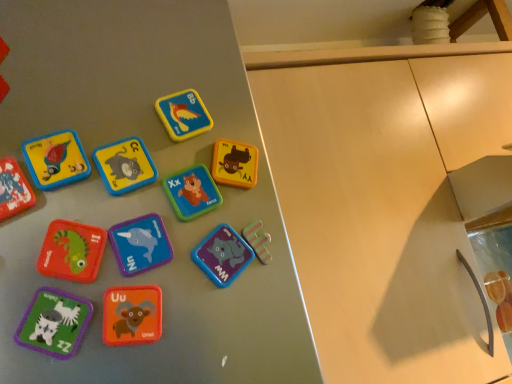
The image size is (512, 384). Find the location of `matte plastic letter at center, which ranks as the 7th toy in bottom-to-top order`. matte plastic letter at center, which ranks as the 7th toy in bottom-to-top order is located at coordinates (192, 192).

Where is `matte yellow square at upper center, the tenth toy ordered from the bottom`? The image size is (512, 384). matte yellow square at upper center, the tenth toy ordered from the bottom is located at coordinates (183, 115).

Image resolution: width=512 pixels, height=384 pixels. Find the location of `purple matte magnet at center, marked as the third toy in a bottom-to-top arrangement`. purple matte magnet at center, marked as the third toy in a bottom-to-top arrangement is located at coordinates (222, 255).

What is the approximate width of rubberized matte green lizard at lower left, the 7th toy viewed from the top?

1.66 inches.

Image resolution: width=512 pixels, height=384 pixels. Describe the element at coordinates (72, 251) in the screenshot. I see `rubberized matte green lizard at lower left, the 7th toy viewed from the top` at that location.

Locate an element on the screen. matte plastic letter at center, which ranks as the 4th toy in top-to-bottom order is located at coordinates (192, 192).

Which is closer, (x=179, y=111) or (x=127, y=247)?

The point (x=127, y=247) is closer.

Which object is thinner, matte yellow square at upper center, the tenth toy ordered from the bottom, or purple matte dolphin at center, positioned as the sixth toy in top-to-bottom order?

Thinner between the two is purple matte dolphin at center, positioned as the sixth toy in top-to-bottom order.

How different are the orientations of matte yellow square at upper center, which is counted as the 1th toy, starting from the top, and purple matte dolphin at center, positioned as the sixth toy in top-to-bottom order, in degrees?

0.00103 degrees.

Are matte yellow square at upper center, the tenth toy ordered from the bottom, and purple matte dolphin at center, the fifth toy ordered from the bottom, located far from each other?

They are positioned close to each other.

Is purple matte magnet at center, which appears as the 8th toy when viewed from the top, at the back of matte yellow square at upper center, the tenth toy ordered from the bottom?

No, purple matte magnet at center, which appears as the 8th toy when viewed from the top, is not at the back of matte yellow square at upper center, the tenth toy ordered from the bottom.

Would you say matte yellow square at upper center, which is counted as the 1th toy, starting from the top, is a long distance from purple matte magnet at center, which appears as the 8th toy when viewed from the top?

No, matte yellow square at upper center, which is counted as the 1th toy, starting from the top, is not far away from purple matte magnet at center, which appears as the 8th toy when viewed from the top.

Starting from the matte yellow square at upper center, the tenth toy ordered from the bottom, which toy is the 2nd one to the right? Please provide its 2D coordinates.

[(222, 255)]

How different are the orientations of rubberized matte green lizard at lower left, which appears as the 4th toy when ordered from the bottom, and matte plastic letter at center, positioned as the eighth toy in bottom-to-top order, in degrees?

rubberized matte green lizard at lower left, which appears as the 4th toy when ordered from the bottom, and matte plastic letter at center, positioned as the eighth toy in bottom-to-top order, are facing 0.00124 degrees away from each other.

Does rubberized matte green lizard at lower left, the 7th toy viewed from the top, have a greater width compared to matte plastic letter at center, positioned as the eighth toy in bottom-to-top order?

Correct, the width of rubberized matte green lizard at lower left, the 7th toy viewed from the top, exceeds that of matte plastic letter at center, positioned as the eighth toy in bottom-to-top order.

This screenshot has width=512, height=384. Identify the location of the 1st toy to the right of the rubberized matte green lizard at lower left, which appears as the 4th toy when ordered from the bottom, starting your count from the anchor. (125, 165).

Does rubberized matte green lizard at lower left, the 7th toy viewed from the top, touch matte plastic letter at center, positioned as the eighth toy in bottom-to-top order?

Absolutely, rubberized matte green lizard at lower left, the 7th toy viewed from the top, is next to and touching matte plastic letter at center, positioned as the eighth toy in bottom-to-top order.

Between point (80, 267) and point (217, 255), which one is positioned behind?

Point (217, 255)

Does rubberized matte green lizard at lower left, the 7th toy viewed from the top, have a greater width compared to purple matte magnet at center, marked as the third toy in a bottom-to-top arrangement?

No.

Considering their positions, is rubberized matte green lizard at lower left, which appears as the 4th toy when ordered from the bottom, located in front of or behind purple matte magnet at center, which appears as the 8th toy when viewed from the top?

rubberized matte green lizard at lower left, which appears as the 4th toy when ordered from the bottom, is positioned closer to the viewer than purple matte magnet at center, which appears as the 8th toy when viewed from the top.

Is purple matte magnet at center, marked as the third toy in a bottom-to-top arrangement, located within rubberized matte green lizard at lower left, which appears as the 4th toy when ordered from the bottom?

No, rubberized matte green lizard at lower left, which appears as the 4th toy when ordered from the bottom, does not contain purple matte magnet at center, marked as the third toy in a bottom-to-top arrangement.

Which is more to the left, matte plastic letter at center, positioned as the eighth toy in bottom-to-top order, or rubberized matte green lizard at lower left, the 7th toy viewed from the top?

Positioned to the left is rubberized matte green lizard at lower left, the 7th toy viewed from the top.

Would you say matte plastic letter at center, positioned as the eighth toy in bottom-to-top order, is a long distance from rubberized matte green lizard at lower left, which appears as the 4th toy when ordered from the bottom?

No, matte plastic letter at center, positioned as the eighth toy in bottom-to-top order, is not far away from rubberized matte green lizard at lower left, which appears as the 4th toy when ordered from the bottom.

From the image's perspective, is matte plastic letter at center, positioned as the eighth toy in bottom-to-top order, located above rubberized matte green lizard at lower left, the 7th toy viewed from the top?

Indeed, from the image's perspective, matte plastic letter at center, positioned as the eighth toy in bottom-to-top order, is shown above rubberized matte green lizard at lower left, the 7th toy viewed from the top.

From the image's perspective, which toy is the 4th one below the matte plastic letter at center, positioned as the eighth toy in bottom-to-top order? Please provide its 2D coordinates.

[(72, 251)]

This screenshot has width=512, height=384. I want to click on the 8th toy positioned below the matte yellow square at upper center, which is counted as the 1th toy, starting from the top (from a real-world perspective), so click(54, 323).

Which is behind, matte green fabric zebra at lower left, arranged as the ninth toy when viewed from the top, or matte yellow square at upper center, the tenth toy ordered from the bottom?

matte yellow square at upper center, the tenth toy ordered from the bottom, is more distant.

Would you say matte yellow square at upper center, the tenth toy ordered from the bottom, is part of matte green fabric zebra at lower left, arranged as the ninth toy when viewed from the top,'s contents?

That's incorrect, matte yellow square at upper center, the tenth toy ordered from the bottom, is not inside matte green fabric zebra at lower left, arranged as the ninth toy when viewed from the top.

Can you confirm if matte green fabric zebra at lower left, which is the 2th toy in bottom-to-top order, is thinner than matte yellow square at upper center, the tenth toy ordered from the bottom?

In fact, matte green fabric zebra at lower left, which is the 2th toy in bottom-to-top order, might be wider than matte yellow square at upper center, the tenth toy ordered from the bottom.

Does point (158, 217) come closer to viewer compared to point (35, 313)?

No, (158, 217) is further to viewer.

Considering the relative sizes of purple matte dolphin at center, positioned as the sixth toy in top-to-bottom order, and matte green fabric zebra at lower left, which is the 2th toy in bottom-to-top order, in the image provided, is purple matte dolphin at center, positioned as the sixth toy in top-to-bottom order, smaller than matte green fabric zebra at lower left, which is the 2th toy in bottom-to-top order,?

Indeed, purple matte dolphin at center, positioned as the sixth toy in top-to-bottom order, has a smaller size compared to matte green fabric zebra at lower left, which is the 2th toy in bottom-to-top order.

Could you tell me if purple matte dolphin at center, positioned as the sixth toy in top-to-bottom order, is facing matte green fabric zebra at lower left, arranged as the ninth toy when viewed from the top?

No, purple matte dolphin at center, positioned as the sixth toy in top-to-bottom order, is not turned towards matte green fabric zebra at lower left, arranged as the ninth toy when viewed from the top.

I want to click on the 6th toy positioned below the matte yellow square at upper center, the tenth toy ordered from the bottom (from a real-world perspective), so click(x=140, y=244).

Where is `the 7th toy positioned below the matte yellow square at upper center, the tenth toy ordered from the bottom (from the image's perspective)`? the 7th toy positioned below the matte yellow square at upper center, the tenth toy ordered from the bottom (from the image's perspective) is located at coordinates (222, 255).

Based on their spatial positions, is matte wood cabinet at center or matte plastic letter at center, marked as the 3th toy in a top-to-bottom arrangement, further from purple matte magnet at center, marked as the third toy in a bottom-to-top arrangement?

Among the two, matte wood cabinet at center is located further to purple matte magnet at center, marked as the third toy in a bottom-to-top arrangement.

Consider the image. From the image, which object appears to be nearer to matte plastic magnet at upper left, the 2th toy positioned from the top, orange matte letter u at center, the 10th toy from the top, or matte yellow square at upper center, the tenth toy ordered from the bottom?

Among the two, matte yellow square at upper center, the tenth toy ordered from the bottom, is located nearer to matte plastic magnet at upper left, the 2th toy positioned from the top.

Based on their spatial positions, is matte plastic magnet at upper left, the ninth toy positioned from the bottom, or orange matte letter u at center, the 10th toy from the top, closer to purple matte dolphin at center, positioned as the sixth toy in top-to-bottom order?

orange matte letter u at center, the 10th toy from the top, is positioned closer to the anchor purple matte dolphin at center, positioned as the sixth toy in top-to-bottom order.

Which object lies further to the anchor point orange matte letter u at center, the first toy when ordered from bottom to top, matte plastic magnet at left, which ranks as the 6th toy in bottom-to-top order, or purple matte magnet at center, marked as the third toy in a bottom-to-top arrangement?

Among the two, matte plastic magnet at left, which ranks as the 6th toy in bottom-to-top order, is located further to orange matte letter u at center, the first toy when ordered from bottom to top.

Based on their spatial positions, is matte plastic magnet at upper left, the 2th toy positioned from the top, or purple matte dolphin at center, the fifth toy ordered from the bottom, further from rubberized matte green lizard at lower left, which appears as the 4th toy when ordered from the bottom?

matte plastic magnet at upper left, the 2th toy positioned from the top, lies further to rubberized matte green lizard at lower left, which appears as the 4th toy when ordered from the bottom, than the other object.

Which object lies further to the anchor point matte yellow square at upper center, the tenth toy ordered from the bottom, matte plastic magnet at upper left, the 2th toy positioned from the top, or rubberized matte green lizard at lower left, the 7th toy viewed from the top?

Based on the image, rubberized matte green lizard at lower left, the 7th toy viewed from the top, appears to be further to matte yellow square at upper center, the tenth toy ordered from the bottom.

When comparing their distances from matte plastic magnet at left, marked as the fifth toy in a top-to-bottom arrangement, does orange matte letter u at center, the 10th toy from the top, or rubberized matte green lizard at lower left, the 7th toy viewed from the top, seem further?

The object further to matte plastic magnet at left, marked as the fifth toy in a top-to-bottom arrangement, is orange matte letter u at center, the 10th toy from the top.

Estimate the real-world distances between objects in this image. Which object is closer to rubberized matte green lizard at lower left, which appears as the 4th toy when ordered from the bottom, matte green fabric zebra at lower left, arranged as the ninth toy when viewed from the top, or matte yellow square at upper center, the tenth toy ordered from the bottom?

matte green fabric zebra at lower left, arranged as the ninth toy when viewed from the top, lies closer to rubberized matte green lizard at lower left, which appears as the 4th toy when ordered from the bottom, than the other object.

Image resolution: width=512 pixels, height=384 pixels. I want to click on toy between matte plastic letter at center, which ranks as the 4th toy in top-to-bottom order, and matte wood cabinet at center from left to right, so click(222, 255).